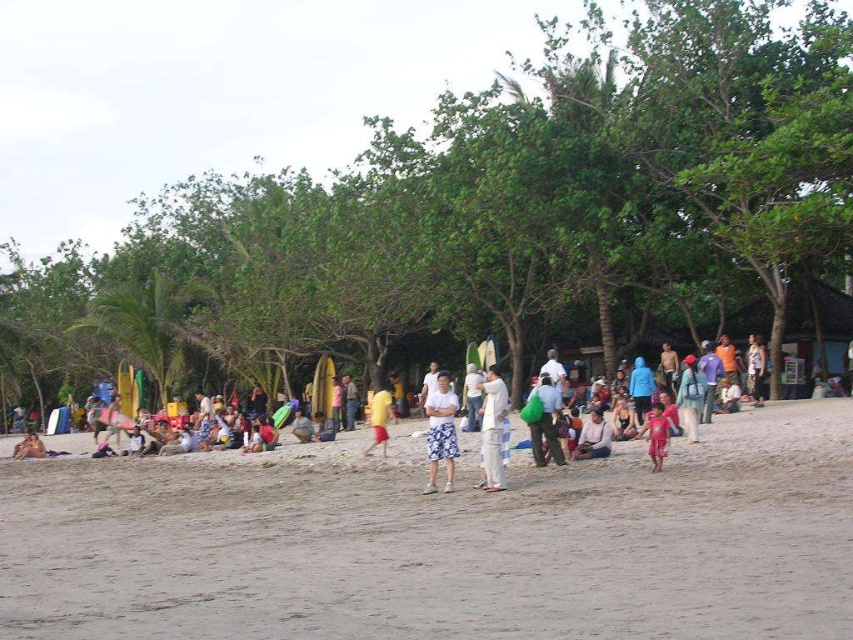
Question: Which point is farther to the camera?

Choices:
 (A) green fabric bag at center
 (B) yellow fabric shorts at center
 (C) floral shorts at center
 (D) brown sandy beach at center

Answer: (B)

Question: Estimate the real-world distances between objects in this image. Which object is closer to the white cotton shirt at center?

Choices:
 (A) floral shorts at center
 (B) light brown wooden chair at center

Answer: (A)

Question: Observing the image, what is the correct spatial positioning of light brown wooden chair at center in reference to pink fabric child at center?

Choices:
 (A) right
 (B) left

Answer: (B)

Question: Does brown sandy beach at center appear over green fabric bag at center?

Choices:
 (A) no
 (B) yes

Answer: (A)

Question: Does floral shorts at center appear on the left side of green fabric bag at center?

Choices:
 (A) no
 (B) yes

Answer: (B)

Question: Estimate the real-world distances between objects in this image. Which object is closer to the light brown skin at lower left?

Choices:
 (A) floral shorts at center
 (B) light brown wooden chair at center

Answer: (B)